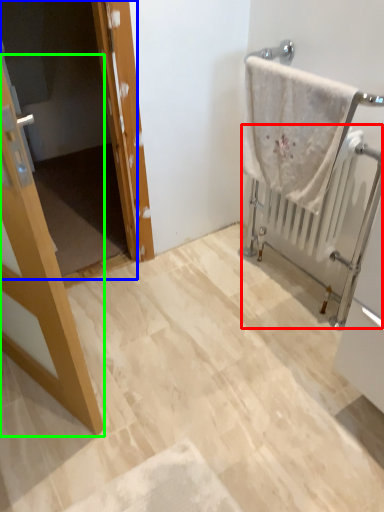
Question: Based on their relative distances, which object is farther from radiator (highlighted by a red box)? Choose from screen door (highlighted by a blue box) and door (highlighted by a green box).

Choices:
 (A) screen door
 (B) door

Answer: (A)